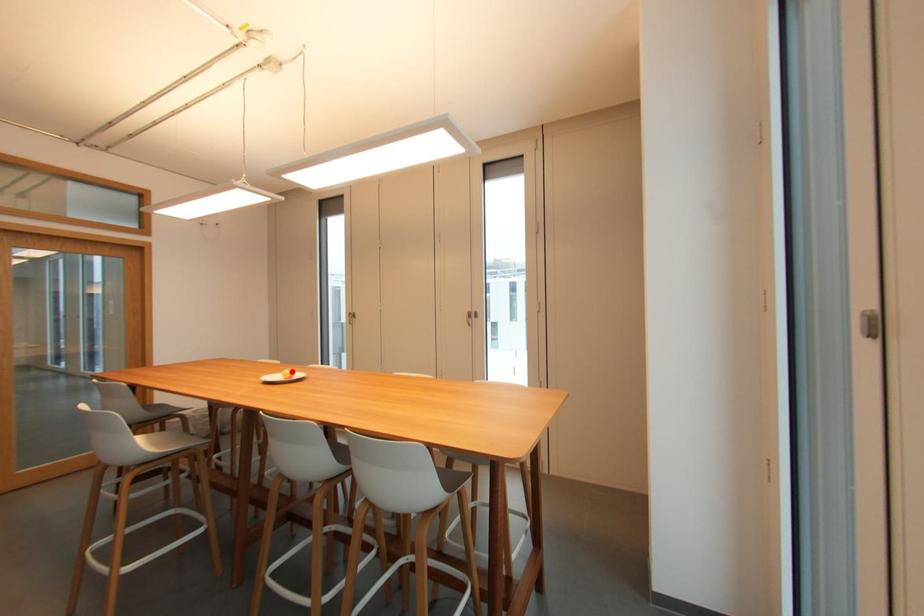
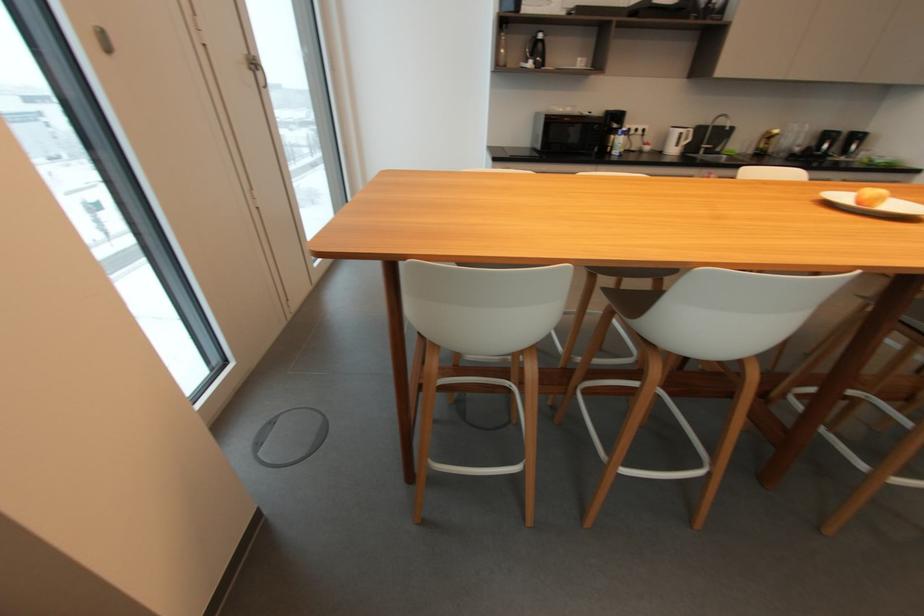
Find the pixel in the second image that matches the highlighted location in the first image.

(881, 191)